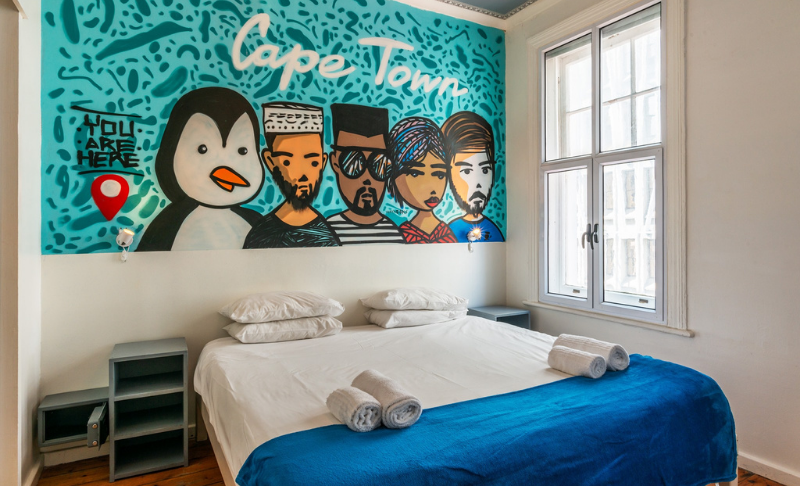
This screenshot has height=486, width=800. What are the coordinates of `mural` in the screenshot? It's located at (202, 58).